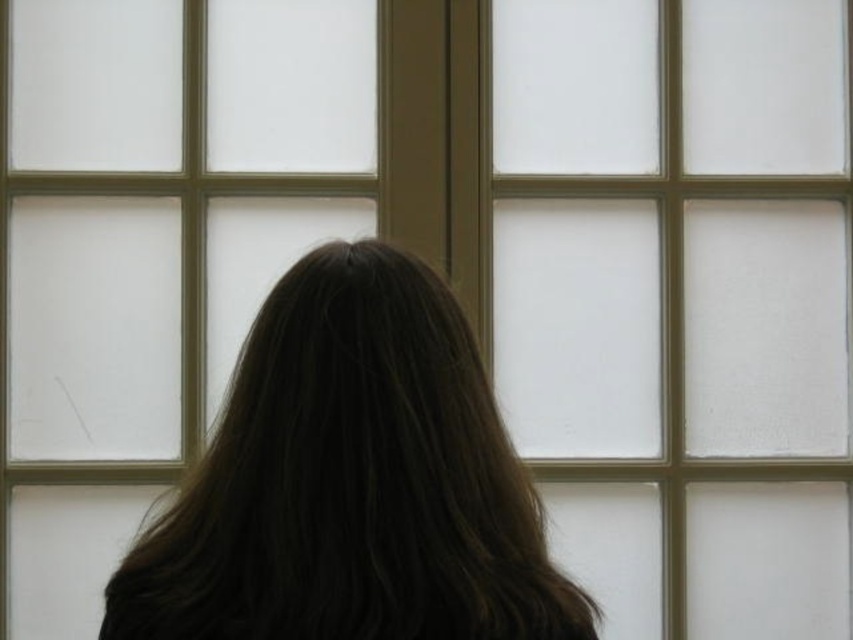
Question: Does white frosted glass at center appear over brown hair at center?

Choices:
 (A) no
 (B) yes

Answer: (B)

Question: Considering the relative positions of white frosted glass at center and brown hair at center in the image provided, where is white frosted glass at center located with respect to brown hair at center?

Choices:
 (A) above
 (B) below

Answer: (A)

Question: Is white frosted glass at center wider than brown hair at center?

Choices:
 (A) yes
 (B) no

Answer: (A)